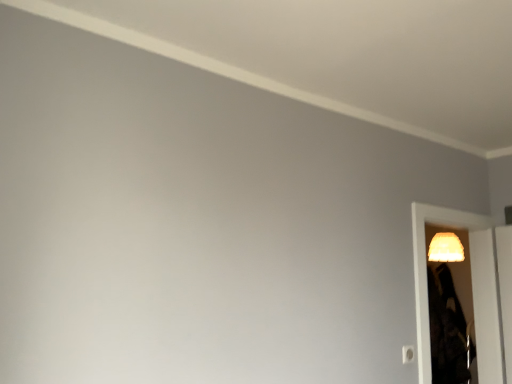
Question: From a real-world perspective, is translucent plastic screen door at right located beneath matte yellow lampshade at right?

Choices:
 (A) no
 (B) yes

Answer: (B)

Question: Is translucent plastic screen door at right next to matte yellow lampshade at right and touching it?

Choices:
 (A) yes
 (B) no

Answer: (B)

Question: Can you confirm if translucent plastic screen door at right is shorter than matte yellow lampshade at right?

Choices:
 (A) yes
 (B) no

Answer: (B)

Question: From the image's perspective, does translucent plastic screen door at right appear lower than matte yellow lampshade at right?

Choices:
 (A) no
 (B) yes

Answer: (B)

Question: Is translucent plastic screen door at right positioned with its back to matte yellow lampshade at right?

Choices:
 (A) yes
 (B) no

Answer: (B)

Question: Is translucent plastic screen door at right surrounding matte yellow lampshade at right?

Choices:
 (A) yes
 (B) no

Answer: (B)

Question: Considering the relative sizes of translucent plastic screen door at right and white plastic light switch at lower right in the image provided, is translucent plastic screen door at right smaller than white plastic light switch at lower right?

Choices:
 (A) yes
 (B) no

Answer: (B)

Question: From a real-world perspective, is translucent plastic screen door at right positioned over white plastic light switch at lower right based on gravity?

Choices:
 (A) yes
 (B) no

Answer: (A)

Question: Is translucent plastic screen door at right facing towards white plastic light switch at lower right?

Choices:
 (A) yes
 (B) no

Answer: (B)

Question: Considering the relative positions of translucent plastic screen door at right and white plastic light switch at lower right in the image provided, is translucent plastic screen door at right behind white plastic light switch at lower right?

Choices:
 (A) no
 (B) yes

Answer: (B)

Question: From the image's perspective, is translucent plastic screen door at right below white plastic light switch at lower right?

Choices:
 (A) yes
 (B) no

Answer: (B)

Question: Is the surface of translucent plastic screen door at right in direct contact with white plastic light switch at lower right?

Choices:
 (A) no
 (B) yes

Answer: (A)

Question: Is white plastic light switch at lower right bigger than translucent plastic screen door at right?

Choices:
 (A) yes
 (B) no

Answer: (B)